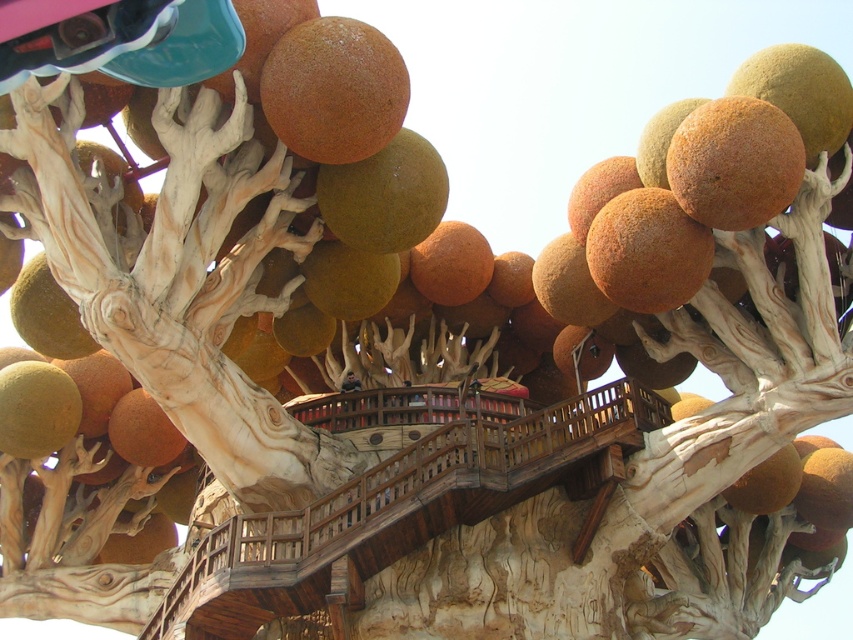
Which is behind, point (637, 294) or point (381, 156)?

The point (637, 294) is more distant.

Who is positioned more to the left, brown matte sphere at center or matte brown sphere at center?

Positioned to the left is matte brown sphere at center.

The height and width of the screenshot is (640, 853). In order to click on brown matte sphere at center in this screenshot , I will do `click(647, 250)`.

You are a GUI agent. You are given a task and a screenshot of the screen. Output one action in this format:
    pyautogui.click(x=<x>, y=<y>)
    Task: Click on the brown matte sphere at center
    The height and width of the screenshot is (640, 853).
    Given the screenshot: What is the action you would take?
    pyautogui.click(x=647, y=250)

Can you confirm if brown matte sphere at center is positioned above green matte fruit at lower left?

Yes.

Is brown matte sphere at center smaller than green matte fruit at lower left?

Actually, brown matte sphere at center might be larger than green matte fruit at lower left.

Is point (669, 266) behind point (42, 444)?

No, it is in front of (42, 444).

The width and height of the screenshot is (853, 640). In order to click on brown matte sphere at center in this screenshot , I will do `click(647, 250)`.

Does wooden at center appear on the left side of green matte fruit at lower left?

Incorrect, wooden at center is not on the left side of green matte fruit at lower left.

Is wooden at center bigger than green matte fruit at lower left?

Indeed, wooden at center has a larger size compared to green matte fruit at lower left.

Is point (302, 529) positioned in front of point (48, 419)?

That is True.

Identify the location of wooden at center. The width and height of the screenshot is (853, 640). [403, 506].